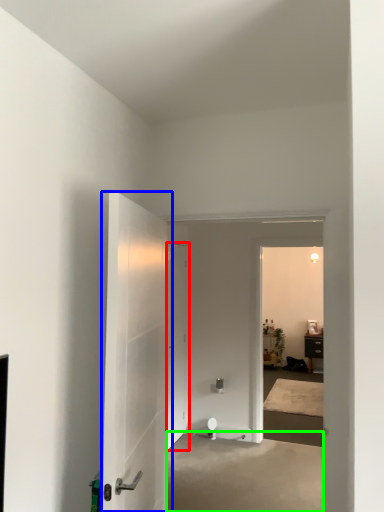
Question: Based on their relative distances, which object is nearer to door (highlighted by a red box)? Choose from door (highlighted by a blue box) and concrete (highlighted by a green box).

Choices:
 (A) door
 (B) concrete

Answer: (B)